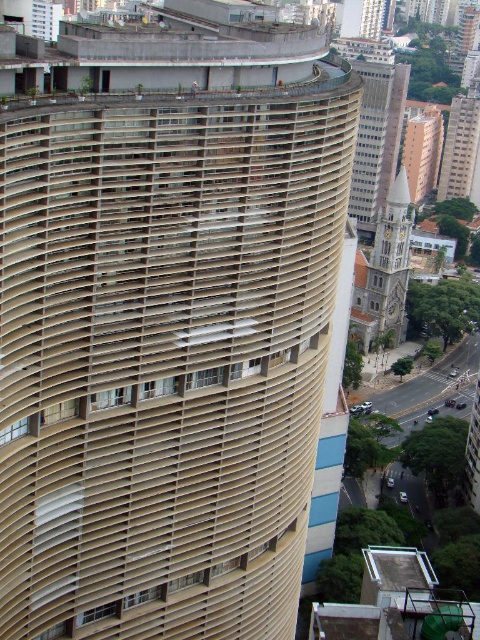
Question: Which of these objects is positioned closest to the beige textured building at center?

Choices:
 (A) beige textured tower at upper right
 (B) white stone tower at right

Answer: (B)

Question: Can you confirm if white stone tower at right is positioned below beige concrete tower at upper right?

Choices:
 (A) no
 (B) yes

Answer: (B)

Question: Which of these objects is positioned farthest from the beige concrete tower at upper right?

Choices:
 (A) beige textured building at center
 (B) beige textured building at upper right

Answer: (A)

Question: Considering the real-world distances, which object is closest to the beige textured building at upper right?

Choices:
 (A) white stone tower at right
 (B) beige textured building at center
 (C) beige concrete tower at upper right

Answer: (C)

Question: Is beige textured building at center smaller than beige textured building at upper right?

Choices:
 (A) yes
 (B) no

Answer: (A)

Question: Does beige textured tower at upper right lie behind beige concrete tower at upper right?

Choices:
 (A) yes
 (B) no

Answer: (B)